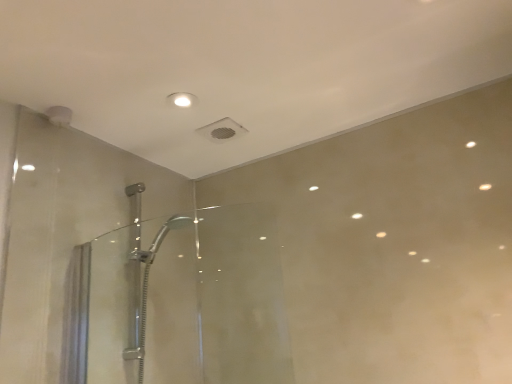
The image size is (512, 384). What do you see at coordinates (181, 302) in the screenshot?
I see `clear glass shower door at center` at bounding box center [181, 302].

Find the location of `clear glass shower door at center`. clear glass shower door at center is located at coordinates (181, 302).

Measure the distance between point (x=87, y=345) and camera.

Point (x=87, y=345) is 1.34 meters from camera.

Where is `clear glass shower door at center`? The height and width of the screenshot is (384, 512). clear glass shower door at center is located at coordinates (181, 302).